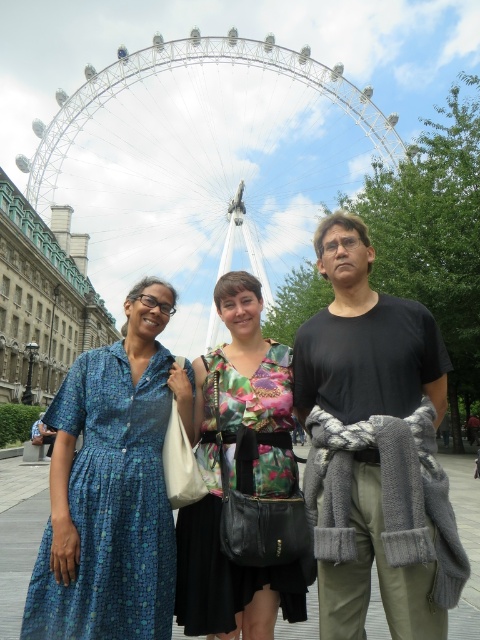
Question: Which object appears farthest from the camera in this image?

Choices:
 (A) white metal ferris wheel at upper center
 (B) dark gray knit scarf at center
 (C) blue printed fabric dress at left
 (D) floral fabric dress at center

Answer: (A)

Question: Does white metal ferris wheel at upper center appear under floral fabric dress at center?

Choices:
 (A) no
 (B) yes

Answer: (A)

Question: Which of the following is the closest to the observer?

Choices:
 (A) (66, 116)
 (B) (379, 392)

Answer: (B)

Question: Is white metal ferris wheel at upper center thinner than blue printed fabric dress at left?

Choices:
 (A) no
 (B) yes

Answer: (A)

Question: Which of the following is the closest to the observer?

Choices:
 (A) (395, 608)
 (B) (226, 291)
 (C) (331, 72)
 (D) (156, 524)

Answer: (A)

Question: Can you confirm if white metal ferris wheel at upper center is positioned below blue printed fabric dress at left?

Choices:
 (A) no
 (B) yes

Answer: (A)